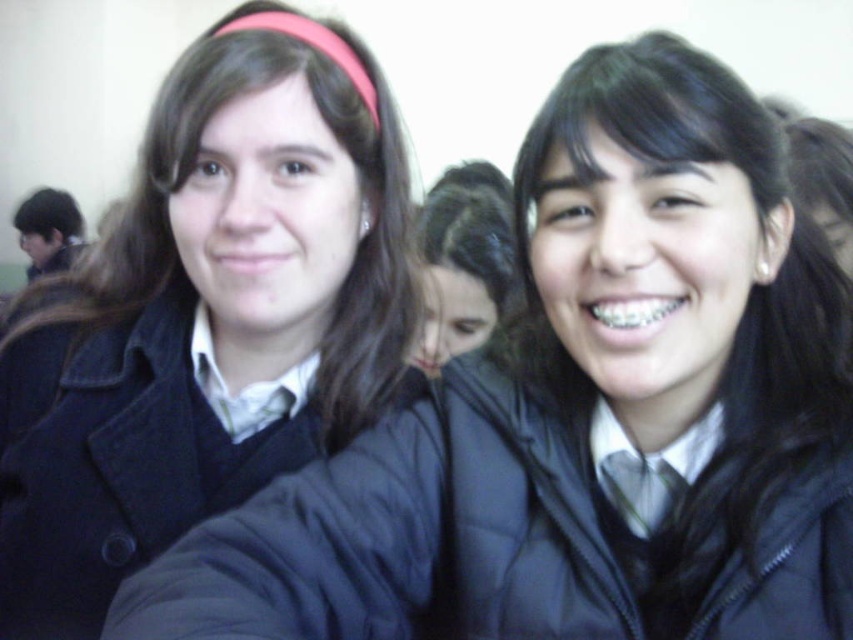
Which of these two, matte black coat at left or dark brown hair at center, stands shorter?

Standing shorter between the two is dark brown hair at center.

Which is below, matte black coat at left or dark brown hair at center?

matte black coat at left

Which is behind, point (294, 214) or point (444, 225)?

The point (444, 225) is behind.

At what (x,y) coordinates should I click in order to perform the action: click on matte black coat at left. Please return your answer as a coordinate pair (x, y). The image size is (853, 640). Looking at the image, I should click on (206, 321).